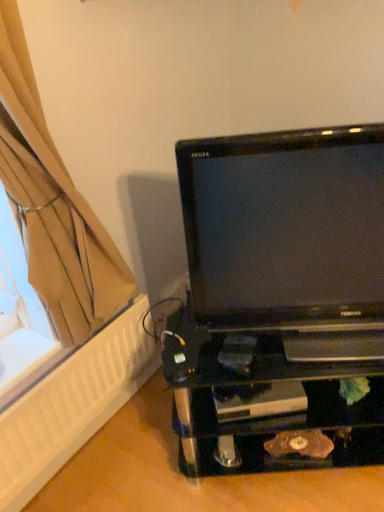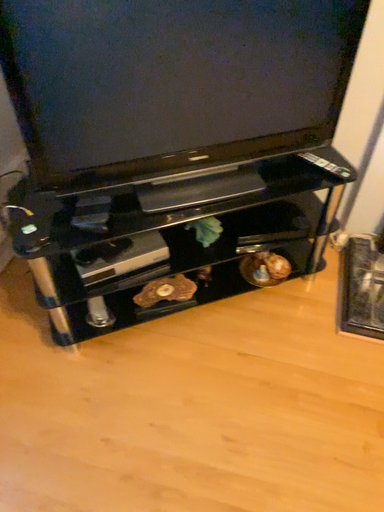
Question: How did the camera likely rotate when shooting the video?

Choices:
 (A) rotated left
 (B) rotated right

Answer: (B)